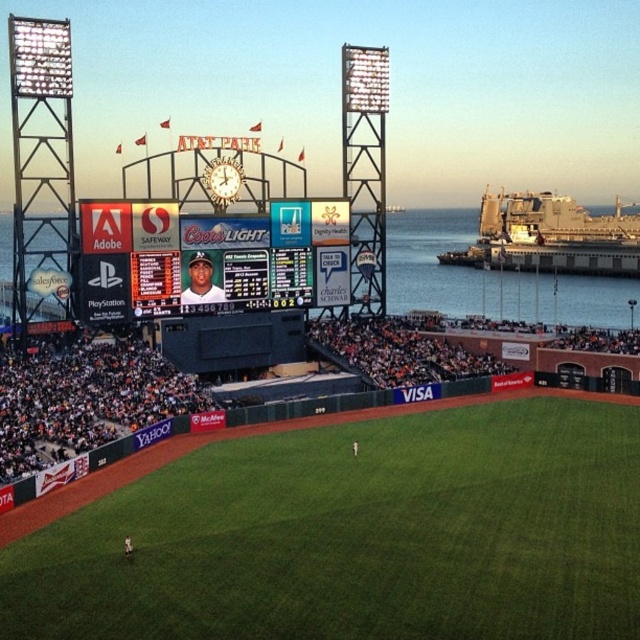
You are a photographer at AT T Park and want to capture both the matte black scoreboard at center and the transparent glass water at upper center in a single shot. Which object will appear taller in your photo?

The transparent glass water at upper center will appear taller in the photo because the matte black scoreboard at center is not as tall as it.

You are a photographer standing at the field edge. You want to capture both the matte black scoreboard at center and the transparent glass water at upper center in one shot. Which object will appear larger in your photo?

The matte black scoreboard at center will appear larger in the photo because it is closer to the viewer than the transparent glass water at upper center.

You are a photographer at AT T Park and want to capture both the matte black scoreboard at center and the transparent glass water at upper center in a single shot. Which object will appear smaller in the photo?

The matte black scoreboard at center will appear smaller in the photo because it has a smaller size compared to the transparent glass water at upper center.